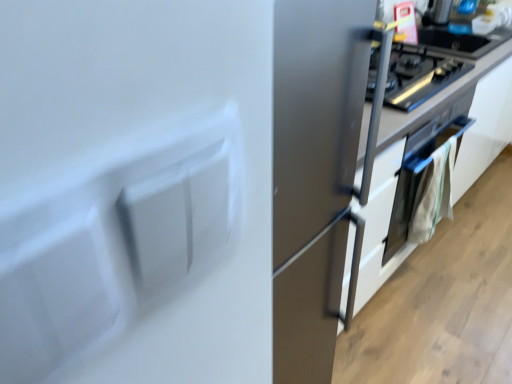
Question: Does satin white cabinet at center have a smaller size compared to satin silver oven at lower right?

Choices:
 (A) no
 (B) yes

Answer: (A)

Question: Is satin silver oven at lower right at the back of satin white cabinet at center?

Choices:
 (A) no
 (B) yes

Answer: (B)

Question: Are satin white cabinet at center and satin silver oven at lower right making contact?

Choices:
 (A) no
 (B) yes

Answer: (A)

Question: Does satin white cabinet at center have a greater width compared to satin silver oven at lower right?

Choices:
 (A) no
 (B) yes

Answer: (B)

Question: Is satin white cabinet at center at the left side of satin silver oven at lower right?

Choices:
 (A) no
 (B) yes

Answer: (A)

Question: Is satin white cabinet at center facing towards satin silver oven at lower right?

Choices:
 (A) yes
 (B) no

Answer: (A)

Question: From a real-world perspective, is satin silver oven at upper right physically below satin silver oven at lower right?

Choices:
 (A) no
 (B) yes

Answer: (A)

Question: Does satin silver oven at upper right have a greater width compared to satin silver oven at lower right?

Choices:
 (A) yes
 (B) no

Answer: (A)

Question: Is the depth of satin silver oven at upper right greater than that of satin silver oven at lower right?

Choices:
 (A) no
 (B) yes

Answer: (A)

Question: From a real-world perspective, is satin silver oven at upper right on top of satin silver oven at lower right?

Choices:
 (A) yes
 (B) no

Answer: (A)

Question: From the image's perspective, is satin silver oven at upper right beneath satin silver oven at lower right?

Choices:
 (A) no
 (B) yes

Answer: (A)

Question: Can you confirm if satin silver oven at upper right is bigger than satin silver oven at lower right?

Choices:
 (A) no
 (B) yes

Answer: (A)

Question: Is satin silver oven at upper right thinner than satin white cabinet at center?

Choices:
 (A) no
 (B) yes

Answer: (B)